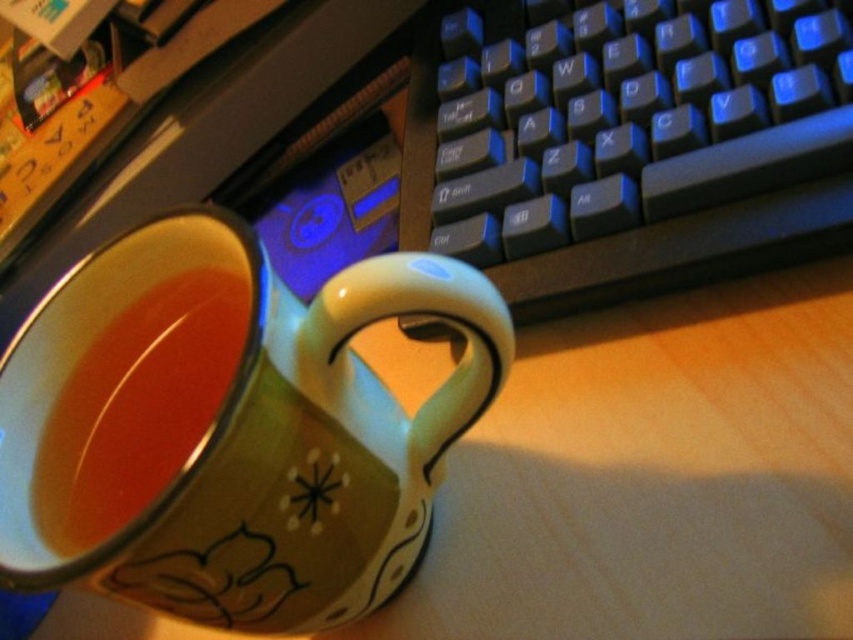
Measure the distance from matte ceramic mug at center to translucent glass tea at center.

matte ceramic mug at center and translucent glass tea at center are 1.35 inches apart.

Between matte ceramic mug at center and translucent glass tea at center, which one appears on the left side from the viewer's perspective?

translucent glass tea at center is more to the left.

Describe the element at coordinates (229, 428) in the screenshot. I see `matte ceramic mug at center` at that location.

Locate an element on the screen. Image resolution: width=853 pixels, height=640 pixels. matte ceramic mug at center is located at coordinates (229, 428).

Does matte ceramic mug at center have a larger size compared to black plastic keyboard at upper right?

No.

Between matte ceramic mug at center and black plastic keyboard at upper right, which one appears on the right side from the viewer's perspective?

Positioned to the right is black plastic keyboard at upper right.

Image resolution: width=853 pixels, height=640 pixels. Describe the element at coordinates (229, 428) in the screenshot. I see `matte ceramic mug at center` at that location.

The width and height of the screenshot is (853, 640). I want to click on matte ceramic mug at center, so [x=229, y=428].

Who is shorter, black plastic keyboard at upper right or translucent glass tea at center?

With less height is translucent glass tea at center.

Is black plastic keyboard at upper right positioned in front of translucent glass tea at center?

No, black plastic keyboard at upper right is further to the viewer.

This screenshot has width=853, height=640. Find the location of `black plastic keyboard at upper right`. black plastic keyboard at upper right is located at coordinates (614, 180).